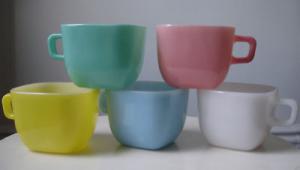
Image resolution: width=300 pixels, height=170 pixels. Identify the location of blue cup. (160, 106).